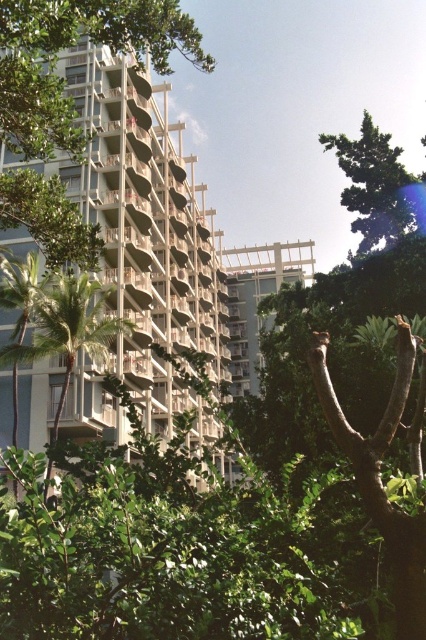
Does white textured building at center have a smaller size compared to green leafy tree at left?

No.

Does white textured building at center come behind green leafy tree at left?

Yes, it is.

At what (x,y) coordinates should I click in order to perform the action: click on white textured building at center. Please return your answer as a coordinate pair (x, y). Looking at the image, I should click on (147, 232).

Who is higher up, white textured building at center or green leafy tree at upper right?

Positioned higher is green leafy tree at upper right.

Between white textured building at center and green leafy tree at upper right, which one has more height?

Standing taller between the two is white textured building at center.

Locate an element on the screen. This screenshot has height=640, width=426. white textured building at center is located at coordinates (147, 232).

Locate an element on the screen. The width and height of the screenshot is (426, 640). white textured building at center is located at coordinates (147, 232).

Is point (371, 134) positioned in front of point (89, 298)?

Yes.

You are a GUI agent. You are given a task and a screenshot of the screen. Output one action in this format:
    pyautogui.click(x=<x>, y=<y>)
    Task: Click on the green leafy tree at upper right
    This screenshot has height=640, width=426.
    Given the screenshot: What is the action you would take?
    pyautogui.click(x=377, y=186)

Who is more forward, (345, 205) or (111, 321)?

Point (345, 205) is in front.

This screenshot has width=426, height=640. Find the location of `green leafy tree at upper right`. green leafy tree at upper right is located at coordinates (377, 186).